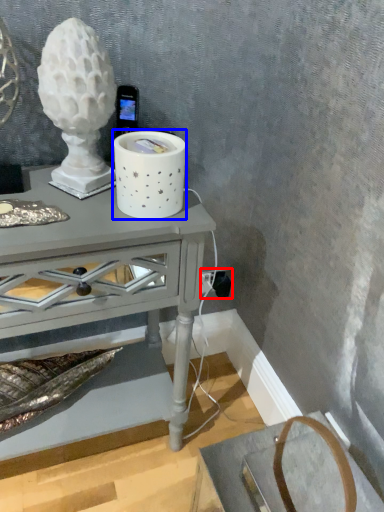
Question: Which object is closer to the camera taking this photo, electric outlet (highlighted by a red box) or candle holder (highlighted by a blue box)?

Choices:
 (A) electric outlet
 (B) candle holder

Answer: (B)